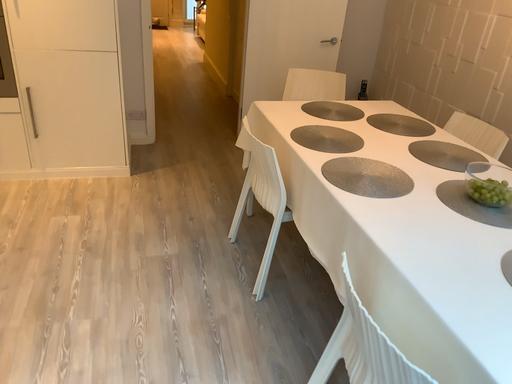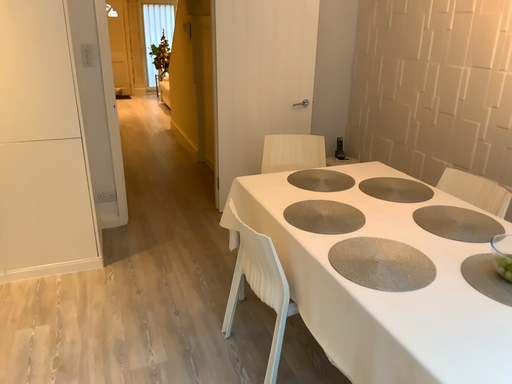
Question: Which way did the camera rotate in the video?

Choices:
 (A) rotated upward
 (B) rotated downward

Answer: (A)